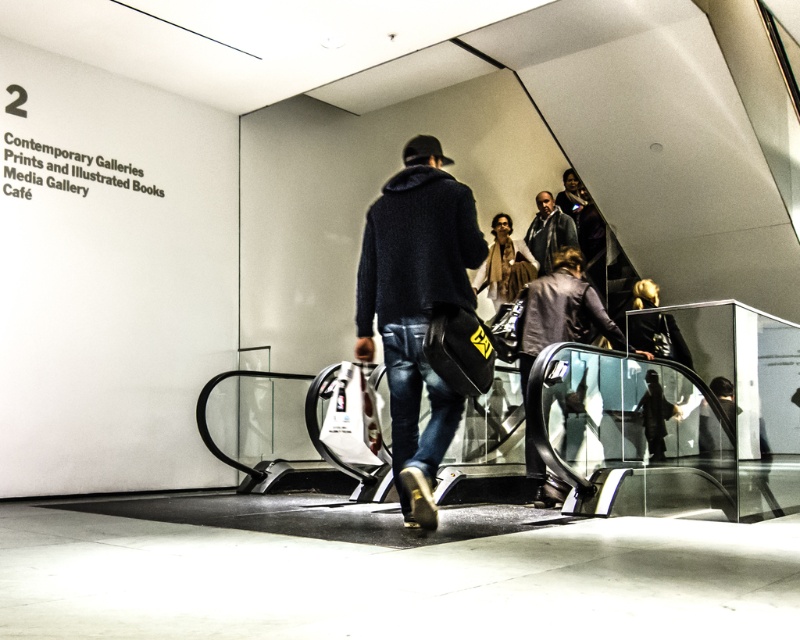
Is the position of dark brown leather jacket at upper center more distant than that of dark gray hoodie at upper center?

That is False.

Identify the location of dark brown leather jacket at upper center. The image size is (800, 640). (554, 307).

Is point (580, 259) positioned before point (568, 220)?

Yes, point (580, 259) is in front of point (568, 220).

Where is `dark brown leather jacket at upper center`? dark brown leather jacket at upper center is located at coordinates (554, 307).

Can you confirm if dark blue sweater at center is positioned to the left of dark gray hoodie at upper center?

Yes, dark blue sweater at center is to the left of dark gray hoodie at upper center.

Who is shorter, dark blue sweater at center or dark gray hoodie at upper center?

Standing shorter between the two is dark gray hoodie at upper center.

Does point (356, 323) lie in front of point (558, 211)?

Yes.

Find the location of a particular element. Image resolution: width=800 pixels, height=640 pixels. dark blue sweater at center is located at coordinates (416, 307).

Does point (380, 221) lie behind point (584, 284)?

No, (380, 221) is closer to viewer.

Which of these two, dark blue sweater at center or dark brown leather jacket at upper center, stands shorter?

Standing shorter between the two is dark brown leather jacket at upper center.

You are a GUI agent. You are given a task and a screenshot of the screen. Output one action in this format:
    pyautogui.click(x=<x>, y=<y>)
    Task: Click on the dark blue sweater at center
    
    Given the screenshot: What is the action you would take?
    pyautogui.click(x=416, y=307)

At what (x,y) coordinates should I click in order to perform the action: click on dark blue sweater at center. Please return your answer as a coordinate pair (x, y). This screenshot has height=640, width=800. Looking at the image, I should click on (416, 307).